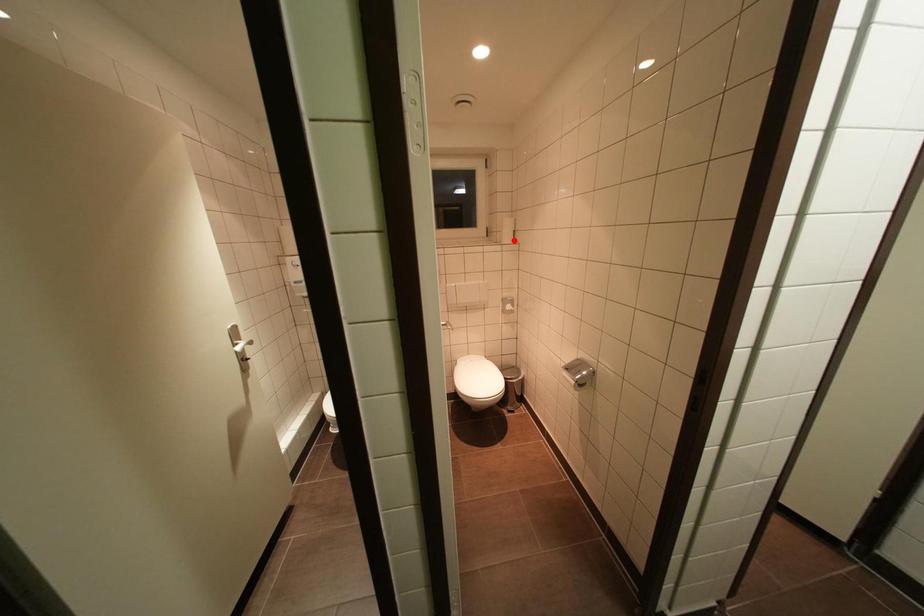
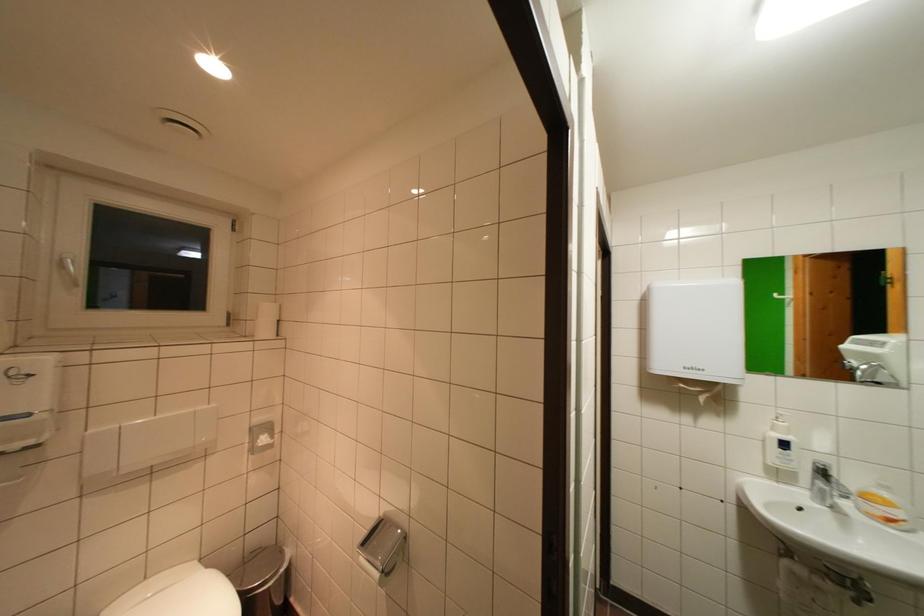
In the second image, find the point that corresponds to the highlighted location in the first image.

(272, 331)